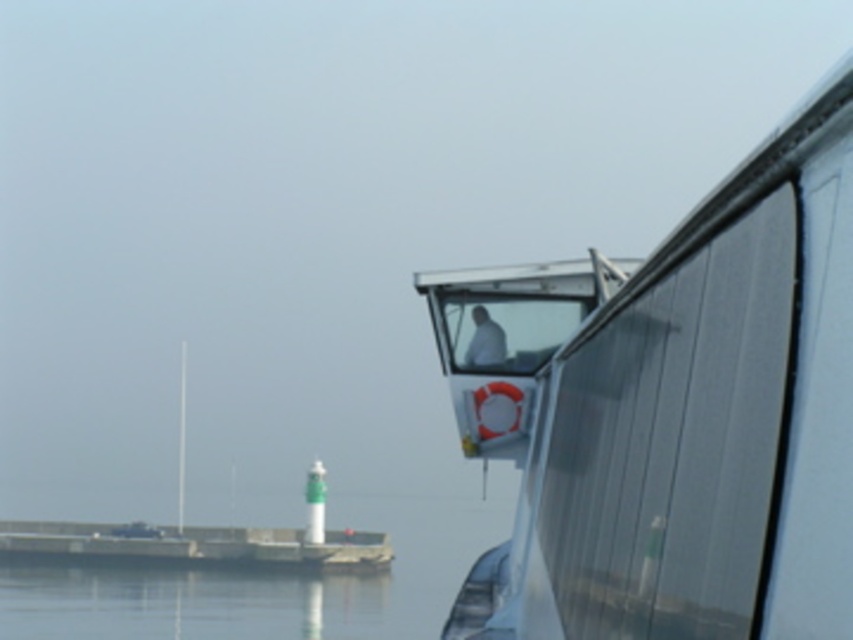
Question: Based on their relative distances, which object is farther from the transparent water at lower left?

Choices:
 (A) concrete dock at lower left
 (B) white glossy boat at upper center

Answer: (B)

Question: Does white glossy boat at upper center appear under transparent water at lower left?

Choices:
 (A) yes
 (B) no

Answer: (B)

Question: Is white glossy boat at upper center smaller than transparent water at lower left?

Choices:
 (A) yes
 (B) no

Answer: (A)

Question: Which point is farther to the camera?

Choices:
 (A) white glossy boat at upper center
 (B) transparent water at lower left

Answer: (B)

Question: Which object appears closest to the camera in this image?

Choices:
 (A) transparent water at lower left
 (B) concrete dock at lower left

Answer: (A)

Question: Is white glossy boat at upper center to the left of transparent water at lower left from the viewer's perspective?

Choices:
 (A) no
 (B) yes

Answer: (A)